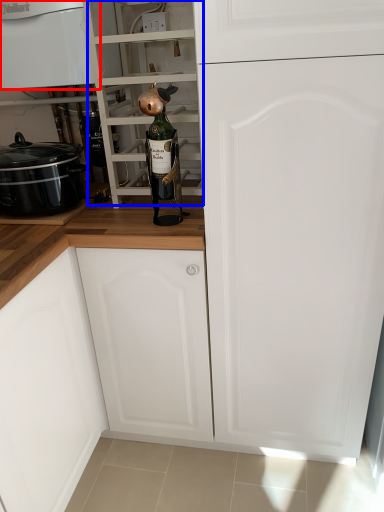
Question: Which object is closer to the camera taking this photo, home appliance (highlighted by a red box) or shelf (highlighted by a blue box)?

Choices:
 (A) home appliance
 (B) shelf

Answer: (B)